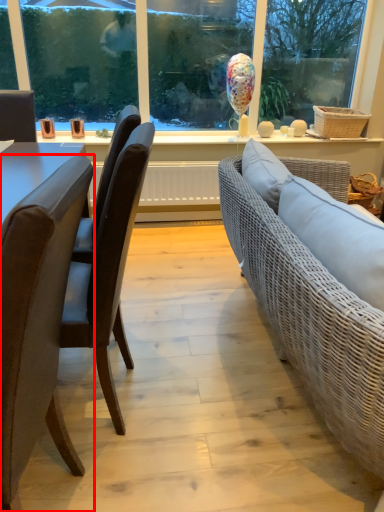
Question: From the image, what is the correct spatial relationship of chair (annotated by the red box) in relation to chair?

Choices:
 (A) right
 (B) left

Answer: (A)